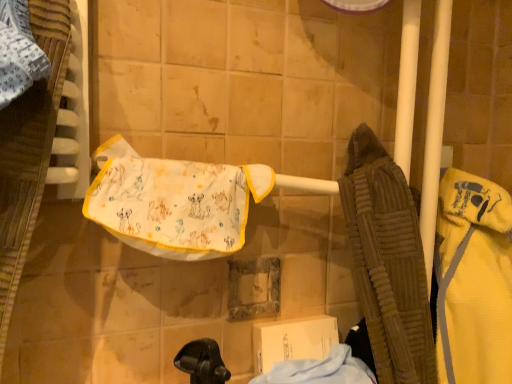
Image resolution: width=512 pixels, height=384 pixels. What do you see at coordinates (473, 280) in the screenshot? I see `yellow fleece bathrobe at right` at bounding box center [473, 280].

Find the location of a particular element. The width and height of the screenshot is (512, 384). light blue cotton cloth at lower center is located at coordinates (320, 370).

What are the coordinates of `yellow fleece bathrobe at right` in the screenshot? It's located at (473, 280).

Which is nearer, (237, 242) or (450, 177)?

Point (237, 242) appears to be closer to the viewer than point (450, 177).

The image size is (512, 384). Find the location of `bathrobe below the white fabric towel at center (from the image's perspective)`. bathrobe below the white fabric towel at center (from the image's perspective) is located at coordinates [473, 280].

Can you confirm if white fabric towel at center is bigger than yellow fleece bathrobe at right?

Actually, white fabric towel at center might be smaller than yellow fleece bathrobe at right.

This screenshot has height=384, width=512. Identify the location of cloth in front of the yellow fleece bathrobe at right. (320, 370).

From a real-world perspective, is yellow fleece bathrobe at right located beneath light blue cotton cloth at lower center?

Incorrect, from a real-world perspective, yellow fleece bathrobe at right is higher than light blue cotton cloth at lower center.

Relative to light blue cotton cloth at lower center, is yellow fleece bathrobe at right in front or behind?

yellow fleece bathrobe at right is behind light blue cotton cloth at lower center.

Which object is wider, yellow fleece bathrobe at right or light blue cotton cloth at lower center?

With larger width is light blue cotton cloth at lower center.

Is white fabric towel at center to the left of light blue cotton cloth at lower center from the viewer's perspective?

Indeed, white fabric towel at center is positioned on the left side of light blue cotton cloth at lower center.

Can you tell me how much white fabric towel at center and light blue cotton cloth at lower center differ in facing direction?

white fabric towel at center and light blue cotton cloth at lower center are facing 0.779 degrees away from each other.

Between point (227, 253) and point (345, 368), which one is positioned behind?

Positioned behind is point (345, 368).

Looking at the image, does yellow fleece bathrobe at right seem bigger or smaller compared to white fabric towel at center?

Clearly, yellow fleece bathrobe at right is larger in size than white fabric towel at center.

Identify the location of underclothes that is in front of the yellow fleece bathrobe at right. This screenshot has height=384, width=512. (176, 205).

From a real-world perspective, which object rests below the other?

In real-world perspective, yellow fleece bathrobe at right is lower.

Which is less distant, (467,301) or (197,229)?

Clearly, point (467,301) is more distant from the camera than point (197,229).

Is light blue cotton cloth at lower center next to yellow fleece bathrobe at right and touching it?

light blue cotton cloth at lower center is not next to yellow fleece bathrobe at right, and they're not touching.

Which is more to the left, light blue cotton cloth at lower center or yellow fleece bathrobe at right?

Positioned to the left is light blue cotton cloth at lower center.

Who is bigger, light blue cotton cloth at lower center or yellow fleece bathrobe at right?

yellow fleece bathrobe at right is bigger.

Could you tell me if light blue cotton cloth at lower center is turned towards white fabric towel at center?

No, light blue cotton cloth at lower center does not turn towards white fabric towel at center.

From the image's perspective, which one is positioned lower, light blue cotton cloth at lower center or white fabric towel at center?

light blue cotton cloth at lower center, from the image's perspective.

From a real-world perspective, which object stands above the other?

white fabric towel at center, from a real-world perspective.

Consider the image. Does light blue cotton cloth at lower center touch white fabric towel at center?

No, light blue cotton cloth at lower center is not beside white fabric towel at center.

Locate an element on the screen. The width and height of the screenshot is (512, 384). underclothes in front of the yellow fleece bathrobe at right is located at coordinates (176, 205).

You are a GUI agent. You are given a task and a screenshot of the screen. Output one action in this format:
    pyautogui.click(x=<x>, y=<y>)
    Task: Click on the bathrobe above the light blue cotton cloth at lower center (from a real-world perspective)
    The height and width of the screenshot is (384, 512).
    Given the screenshot: What is the action you would take?
    pyautogui.click(x=473, y=280)

Considering their positions, is yellow fleece bathrobe at right positioned closer to white fabric towel at center than light blue cotton cloth at lower center?

The object closer to white fabric towel at center is light blue cotton cloth at lower center.

When comparing their distances from yellow fleece bathrobe at right, does light blue cotton cloth at lower center or white fabric towel at center seem further?

white fabric towel at center is further to yellow fleece bathrobe at right.

Based on their spatial positions, is white fabric towel at center or light blue cotton cloth at lower center further from yellow fleece bathrobe at right?

Based on the image, white fabric towel at center appears to be further to yellow fleece bathrobe at right.

Based on their spatial positions, is yellow fleece bathrobe at right or white fabric towel at center closer to light blue cotton cloth at lower center?

The object closer to light blue cotton cloth at lower center is yellow fleece bathrobe at right.

From the picture: Looking at the image, which one is located closer to white fabric towel at center, light blue cotton cloth at lower center or yellow fleece bathrobe at right?

Among the two, light blue cotton cloth at lower center is located nearer to white fabric towel at center.

Considering their positions, is white fabric towel at center positioned further to light blue cotton cloth at lower center than yellow fleece bathrobe at right?

white fabric towel at center.

You are a GUI agent. You are given a task and a screenshot of the screen. Output one action in this format:
    pyautogui.click(x=<x>, y=<y>)
    Task: Click on the cloth situated between white fabric towel at center and yellow fleece bathrobe at right from left to right
    
    Given the screenshot: What is the action you would take?
    pyautogui.click(x=320, y=370)